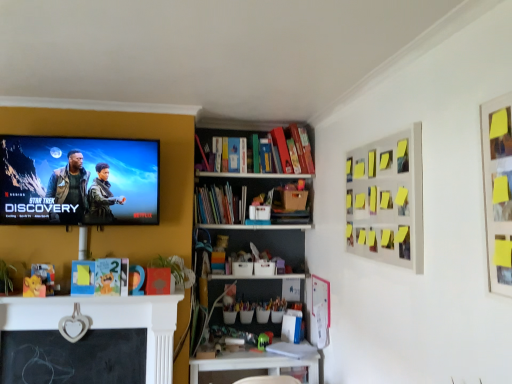
Question: Is matte black screen at upper left thinner than yellow sticky notes at upper right?

Choices:
 (A) no
 (B) yes

Answer: (A)

Question: From a real-world perspective, is matte black screen at upper left positioned under yellow sticky notes at upper right based on gravity?

Choices:
 (A) yes
 (B) no

Answer: (B)

Question: From a real-world perspective, is matte black screen at upper left on yellow sticky notes at upper right?

Choices:
 (A) yes
 (B) no

Answer: (A)

Question: Is matte black screen at upper left with yellow sticky notes at upper right?

Choices:
 (A) yes
 (B) no

Answer: (B)

Question: From the image's perspective, is matte black screen at upper left below yellow sticky notes at upper right?

Choices:
 (A) yes
 (B) no

Answer: (B)

Question: Is matte black screen at upper left positioned before yellow sticky notes at upper right?

Choices:
 (A) no
 (B) yes

Answer: (A)

Question: From a real-world perspective, does white plastic table at lower center sit lower than green plastic toy at lower center?

Choices:
 (A) yes
 (B) no

Answer: (A)

Question: Can you confirm if white plastic table at lower center is smaller than green plastic toy at lower center?

Choices:
 (A) yes
 (B) no

Answer: (B)

Question: Considering the relative sizes of white plastic table at lower center and green plastic toy at lower center in the image provided, is white plastic table at lower center taller than green plastic toy at lower center?

Choices:
 (A) yes
 (B) no

Answer: (A)

Question: Is white plastic table at lower center facing away from green plastic toy at lower center?

Choices:
 (A) no
 (B) yes

Answer: (A)

Question: From the image's perspective, does white plastic table at lower center appear lower than green plastic toy at lower center?

Choices:
 (A) yes
 (B) no

Answer: (A)

Question: Is white plastic table at lower center in contact with green plastic toy at lower center?

Choices:
 (A) yes
 (B) no

Answer: (B)

Question: Is the position of white plastic table at lower center more distant than that of yellow sticky notes at upper right?

Choices:
 (A) yes
 (B) no

Answer: (A)